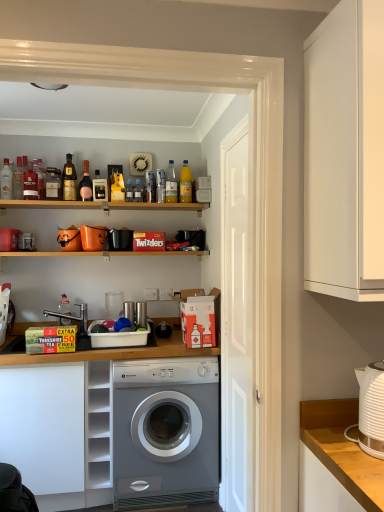
Locate an element on the screen. vacant area that lies to the right of translucent amber bottle at upper left, marked as the 1th bottle in a left-to-right arrangement is located at coordinates (60, 200).